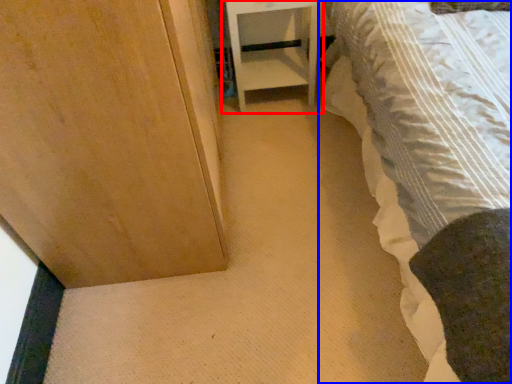
Question: Which object appears closest to the camera in this image, furniture (highlighted by a red box) or bed (highlighted by a blue box)?

Choices:
 (A) furniture
 (B) bed

Answer: (B)